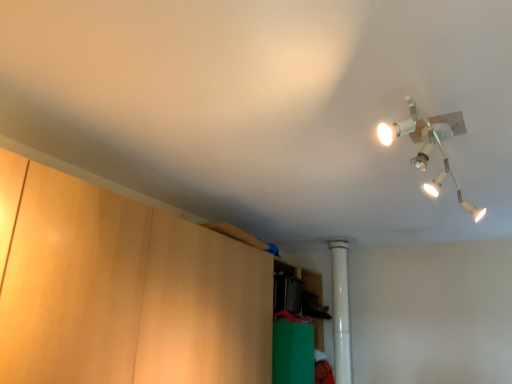
Question: Is green matte cabinet at lower center, which ranks as the 2th cabinetry in front-to-back order, oriented towards wooden cabinet at left, the 1th cabinetry viewed from the front?

Choices:
 (A) yes
 (B) no

Answer: (A)

Question: Is green matte cabinet at lower center, which ranks as the 2th cabinetry in front-to-back order, smaller than wooden cabinet at left, which ranks as the 2th cabinetry in back-to-front order?

Choices:
 (A) yes
 (B) no

Answer: (A)

Question: Would you say green matte cabinet at lower center, which is the 1th cabinetry from back to front, contains wooden cabinet at left, which ranks as the 2th cabinetry in back-to-front order?

Choices:
 (A) no
 (B) yes

Answer: (A)

Question: From the image's perspective, is green matte cabinet at lower center, which is the 1th cabinetry from back to front, on wooden cabinet at left, the 1th cabinetry viewed from the front?

Choices:
 (A) no
 (B) yes

Answer: (A)

Question: Does green matte cabinet at lower center, which is the 1th cabinetry from back to front, come in front of wooden cabinet at left, the 1th cabinetry viewed from the front?

Choices:
 (A) yes
 (B) no

Answer: (B)

Question: Are green matte cabinet at lower center, which ranks as the 2th cabinetry in front-to-back order, and wooden cabinet at left, the 1th cabinetry viewed from the front, far apart?

Choices:
 (A) yes
 (B) no

Answer: (B)

Question: Considering the relative sizes of white plastic pipe at center and green matte cabinet at lower center, which ranks as the 2th cabinetry in front-to-back order, in the image provided, is white plastic pipe at center wider than green matte cabinet at lower center, which ranks as the 2th cabinetry in front-to-back order,?

Choices:
 (A) no
 (B) yes

Answer: (A)

Question: Is white plastic pipe at center to the left of green matte cabinet at lower center, which is the 1th cabinetry from back to front, from the viewer's perspective?

Choices:
 (A) no
 (B) yes

Answer: (A)

Question: Does white plastic pipe at center have a greater height compared to green matte cabinet at lower center, which is the 1th cabinetry from back to front?

Choices:
 (A) yes
 (B) no

Answer: (A)

Question: From the image's perspective, would you say white plastic pipe at center is shown under green matte cabinet at lower center, which ranks as the 2th cabinetry in front-to-back order?

Choices:
 (A) no
 (B) yes

Answer: (A)

Question: From a real-world perspective, is white plastic pipe at center located beneath green matte cabinet at lower center, which ranks as the 2th cabinetry in front-to-back order?

Choices:
 (A) no
 (B) yes

Answer: (A)

Question: Is white plastic pipe at center placed right next to green matte cabinet at lower center, which is the 1th cabinetry from back to front?

Choices:
 (A) yes
 (B) no

Answer: (B)

Question: Is the depth of white metallic lamp at upper right less than that of wooden cabinet at left, which ranks as the 2th cabinetry in back-to-front order?

Choices:
 (A) no
 (B) yes

Answer: (A)